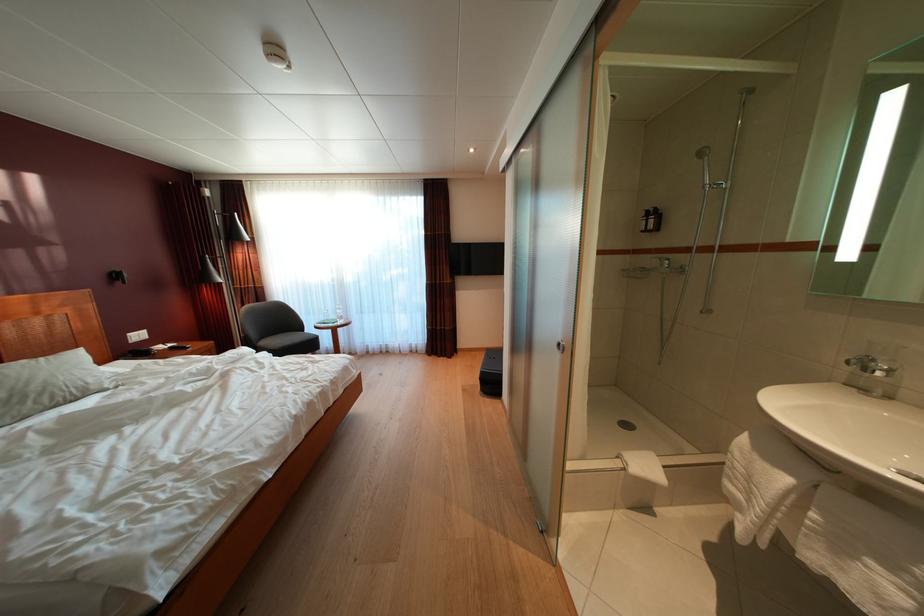
Where is `sink faucet handle`? This screenshot has height=616, width=924. sink faucet handle is located at coordinates (872, 365).